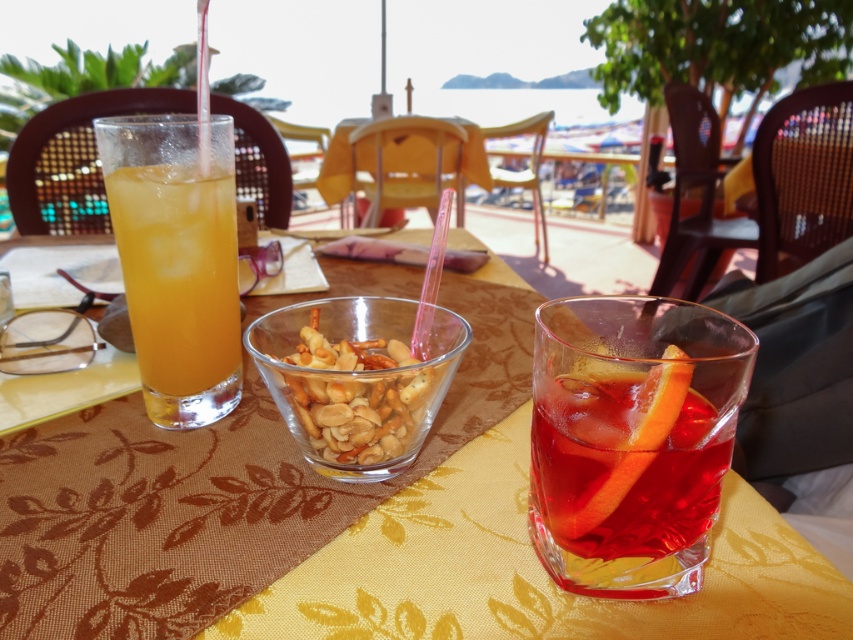
You are a server at the beachside restaurant. You need to place a new menu that is 8 inches long on the table without moving any of the existing items. Is there enough space between the translucent glass drink at center and the edge of the table to fit the menu?

The translucent glass drink at center is 7.35 inches away from the viewer. Since the menu is 8 inches long, it may not fit if the space between the drink and the table edge is less than 8 inches. However, without knowing the exact table dimensions or the distance from the drink to the edge, it is impossible to determine definitively.

Based on the photo, you are setting up a picnic and have a small container of snacks. You want to place it on the table so that it fits entirely on the yellow fabric placemat at center without overlapping the translucent glass bowl of mixed nuts at center. Is this possible?

The yellow fabric placemat at center is larger in size than the translucent glass bowl of mixed nuts at center, so yes, the container can be placed on the placemat without overlapping the bowl.